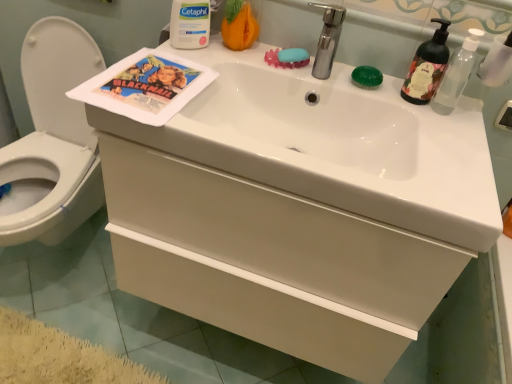
The image size is (512, 384). Identify the location of vacant region to the left of translucent plastic pump bottle at upper right. (385, 91).